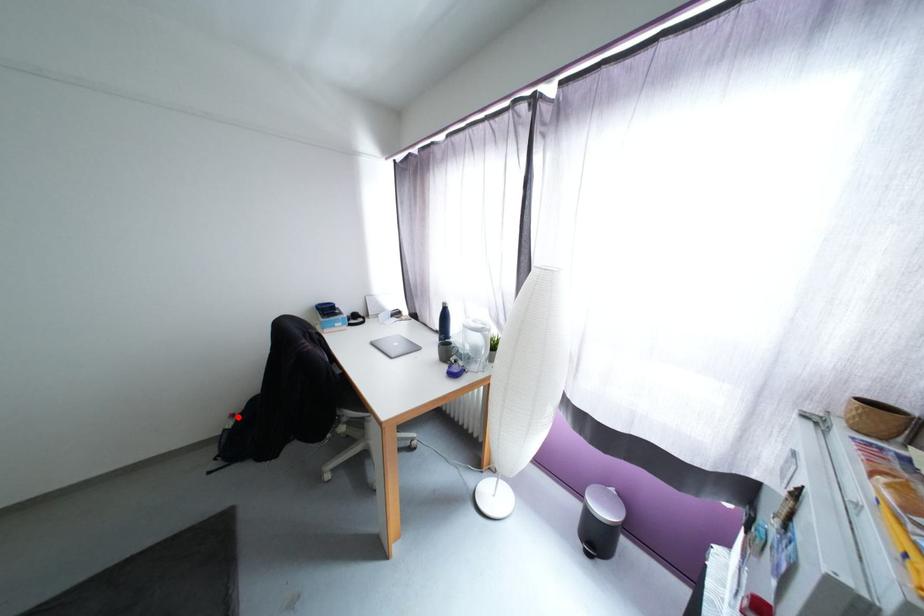
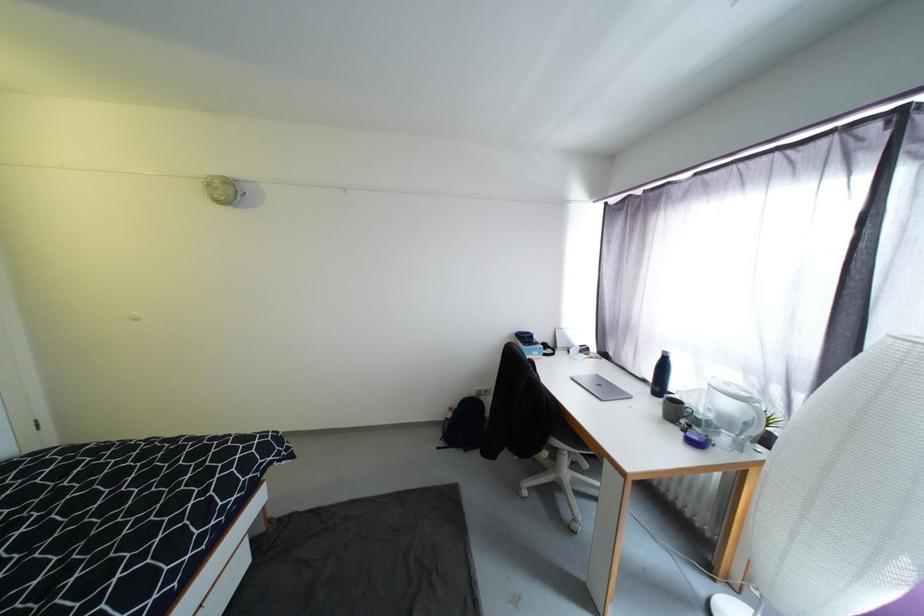
Find the pixel in the second image that matches the highlighted location in the first image.

(456, 410)